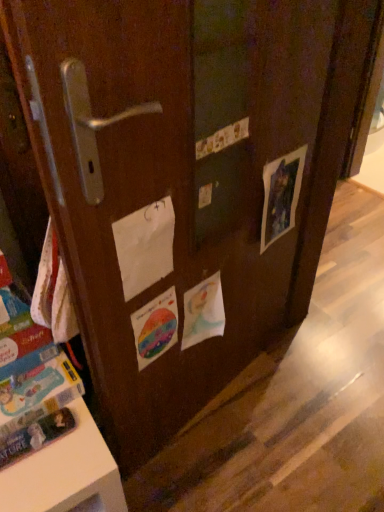
Question: Considering their positions, is blue cardboard book at lower left located in front of or behind rainbow paper flyer at center, which is counted as the 1th flyer, starting from the left?

Choices:
 (A) front
 (B) behind

Answer: (A)

Question: Is blue cardboard book at lower left spatially inside rainbow paper flyer at center, placed as the 3th flyer when sorted from right to left, or outside of it?

Choices:
 (A) inside
 (B) outside

Answer: (B)

Question: Which object is positioned farthest from the blue cardboard book at lower left?

Choices:
 (A) rainbow paper flyer at center, which is counted as the 1th flyer, starting from the left
 (B) watercolor paper flyer at center, which is the 2th flyer from left to right
 (C) white paper at center
 (D) matte paper picture at right, the 3th flyer when ordered from left to right

Answer: (D)

Question: Estimate the real-world distances between objects in this image. Which object is farther from the rainbow paper flyer at center, placed as the 3th flyer when sorted from right to left?

Choices:
 (A) white paper at center
 (B) watercolor paper flyer at center, which is the 2th flyer from left to right
 (C) matte paper picture at right, the 3th flyer when ordered from left to right
 (D) blue cardboard book at lower left

Answer: (C)